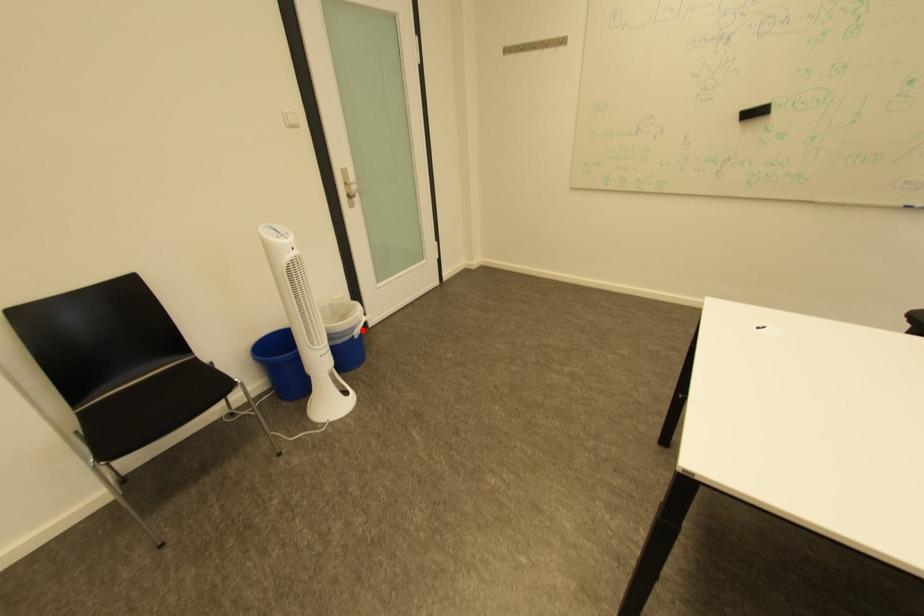
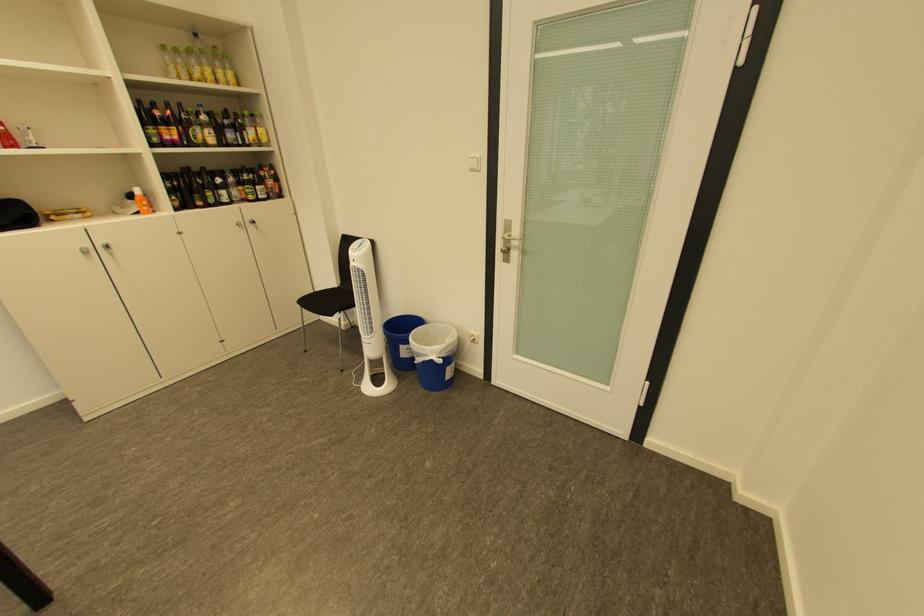
Question: I am providing you with two images of the same scene from different viewpoints. A red point is marked on the first image. At the location where the point appears in image 1, is it still visible in image 2?

Choices:
 (A) Yes
 (B) No

Answer: (A)